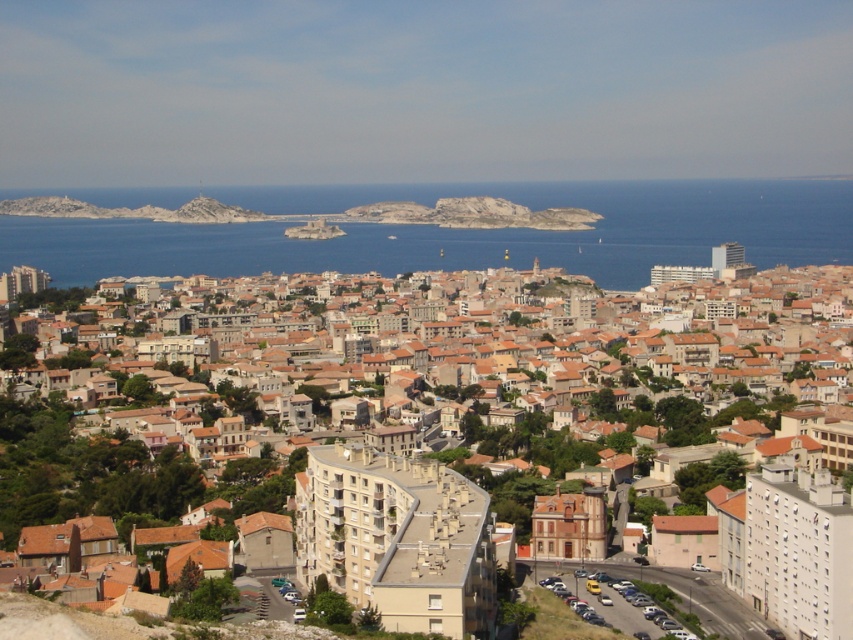
You are standing at the point marked as point [633,403] in the image. What is the most prominent feature directly in front of you?

The most prominent feature directly in front of you at point [633,403] is the brown textured buildings at center.

You are standing in the coastal city depicted in the image and want to determine which of the two points, point (682, 449) or point (560, 198), is closer to you. Based on the scene, which point is nearer?

Point (682, 449) is closer to the viewer than point (560, 198).